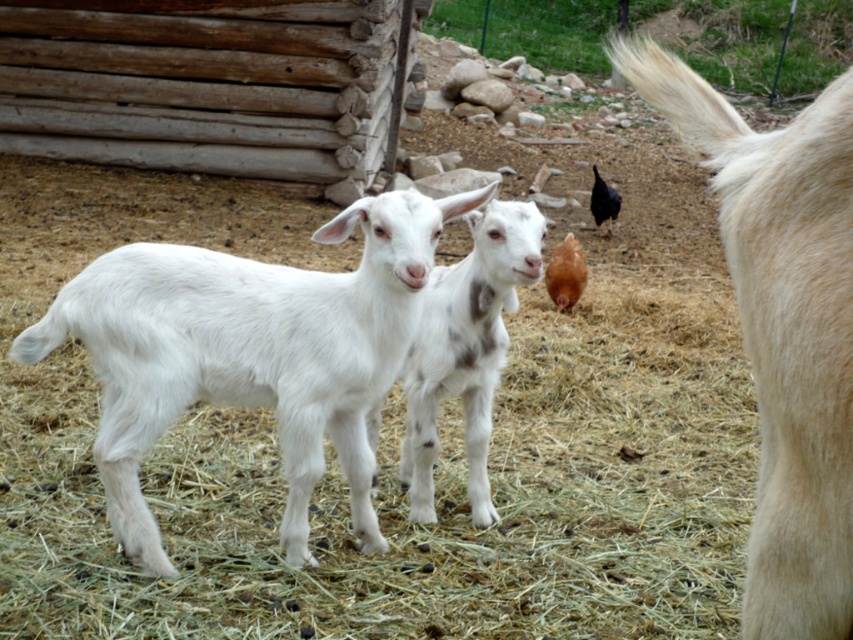
Can you confirm if white soft hay at center is positioned below white woolen goat at right?

Yes.

Which of these two, white soft hay at center or white woolen goat at right, stands shorter?

white woolen goat at right is shorter.

This screenshot has height=640, width=853. I want to click on white soft hay at center, so click(x=405, y=493).

This screenshot has width=853, height=640. Identify the location of white soft hay at center. tap(405, 493).

Is white woolen goat at center to the left of white woolen goat at right from the viewer's perspective?

Yes, white woolen goat at center is to the left of white woolen goat at right.

Can you confirm if white woolen goat at center is positioned below white woolen goat at right?

Correct, white woolen goat at center is located below white woolen goat at right.

Is point (286, 348) behind point (786, 164)?

That is True.

The image size is (853, 640). In order to click on white woolen goat at center in this screenshot , I will do `click(248, 353)`.

Looking at this image, does white soft hay at center appear over white woolen goat at center?

Incorrect, white soft hay at center is not positioned above white woolen goat at center.

Does white soft hay at center have a greater width compared to white woolen goat at center?

Correct, the width of white soft hay at center exceeds that of white woolen goat at center.

Is point (693, 515) farther from viewer compared to point (146, 300)?

Yes, it is.

The width and height of the screenshot is (853, 640). Find the location of `white soft hay at center`. white soft hay at center is located at coordinates (405, 493).